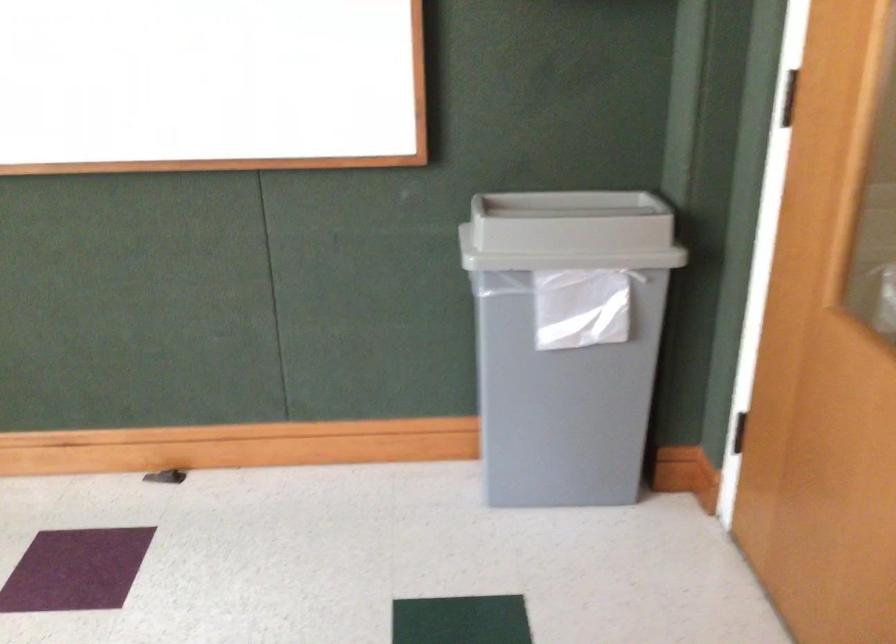
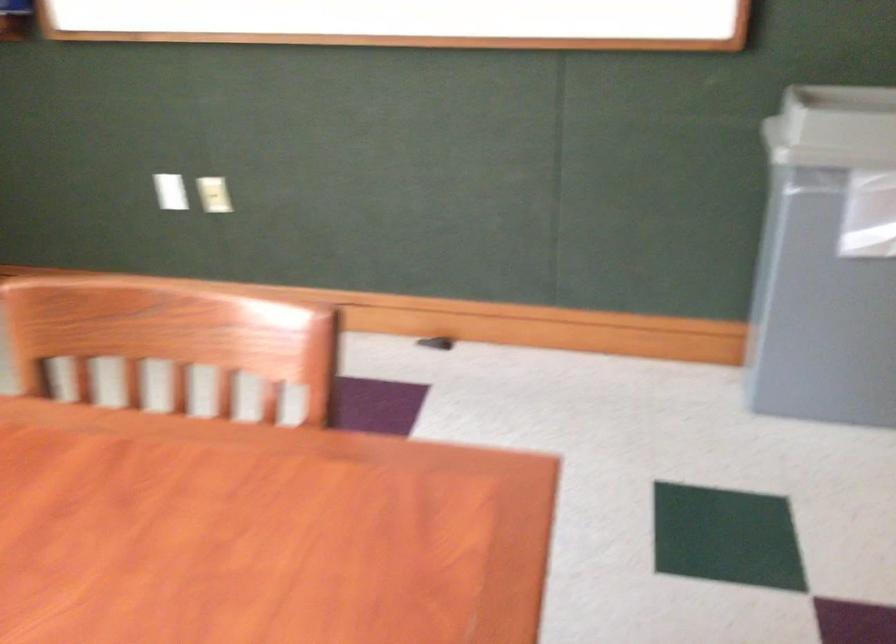
Question: How did the camera likely rotate?

Choices:
 (A) Left
 (B) Right
 (C) Up
 (D) Down

Answer: (A)